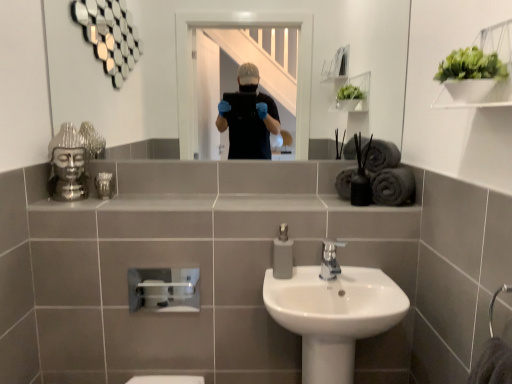
Image resolution: width=512 pixels, height=384 pixels. I want to click on vacant area that is situated to the right of metallic glass at upper left, so click(142, 192).